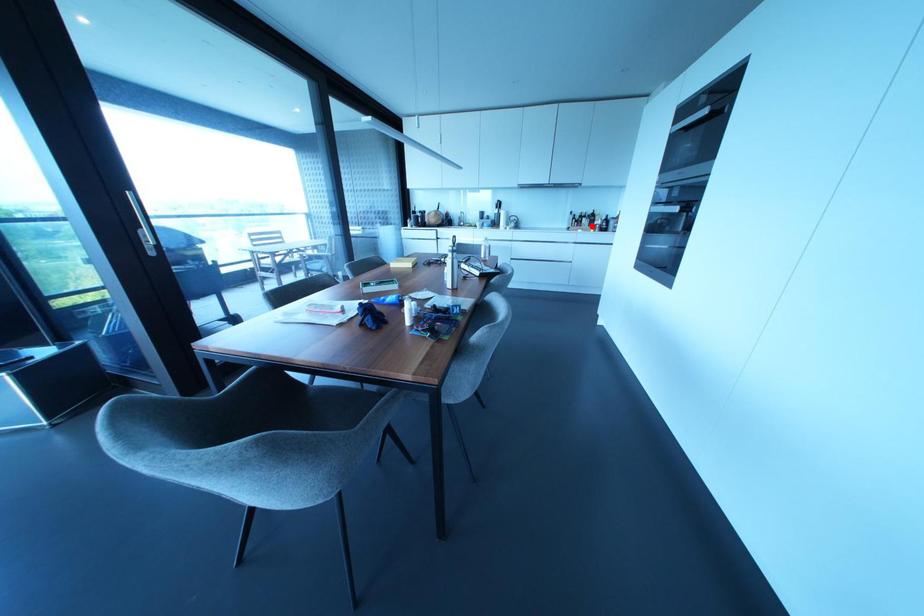
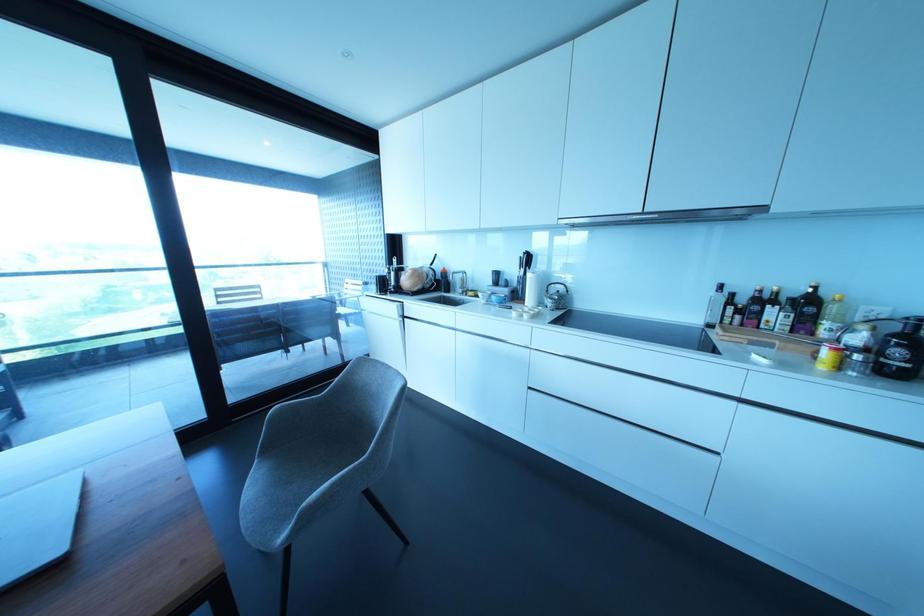
The point at the highlighted location is marked in the first image. Where is the corresponding point in the second image?

(825, 353)